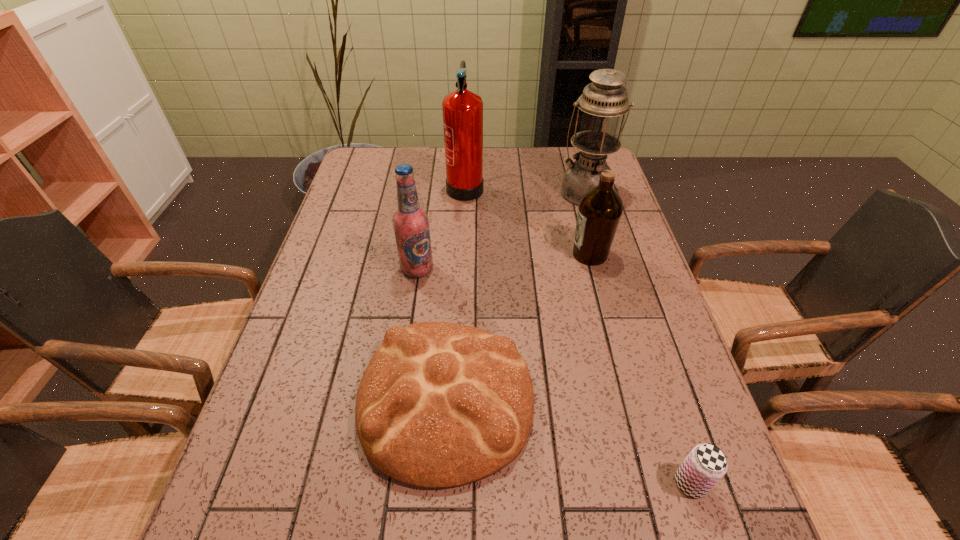
The height and width of the screenshot is (540, 960). Identify the location of vacant space at the far edge of the desktop. (533, 176).

At what (x,y) coordinates should I click in order to perform the action: click on vacant position at the left edge of the desktop. Please return your answer as a coordinate pair (x, y). The image size is (960, 540). Looking at the image, I should click on (390, 190).

You are a GUI agent. You are given a task and a screenshot of the screen. Output one action in this format:
    pyautogui.click(x=<x>, y=<y>)
    Task: Click on the free region at the right edge
    Image resolution: width=960 pixels, height=540 pixels.
    Given the screenshot: What is the action you would take?
    pyautogui.click(x=688, y=376)

At what (x,y) coordinates should I click in order to perform the action: click on vacant space at the near left corner of the desktop. Please return your answer as a coordinate pair (x, y). The width and height of the screenshot is (960, 540). Looking at the image, I should click on (278, 531).

Image resolution: width=960 pixels, height=540 pixels. Find the location of `free space between the fire extinguisher and the alcohol`. free space between the fire extinguisher and the alcohol is located at coordinates (442, 227).

The image size is (960, 540). What are the coordinates of `free space between the fourth shortest object and the olive oil` in the screenshot? It's located at (504, 261).

Image resolution: width=960 pixels, height=540 pixels. I want to click on vacant area that lies between the third tallest object and the shortest object, so click(554, 376).

At what (x,y) coordinates should I click in order to perform the action: click on vacant space in between the alcohol and the shortest object. Please return your answer as a coordinate pair (x, y). This screenshot has height=540, width=960. Looking at the image, I should click on (554, 376).

Image resolution: width=960 pixels, height=540 pixels. Identify the location of vacant space in between the fire extinguisher and the shortest object. (578, 334).

Find the location of `free area in between the beer can and the fire extinguisher`. free area in between the beer can and the fire extinguisher is located at coordinates (578, 334).